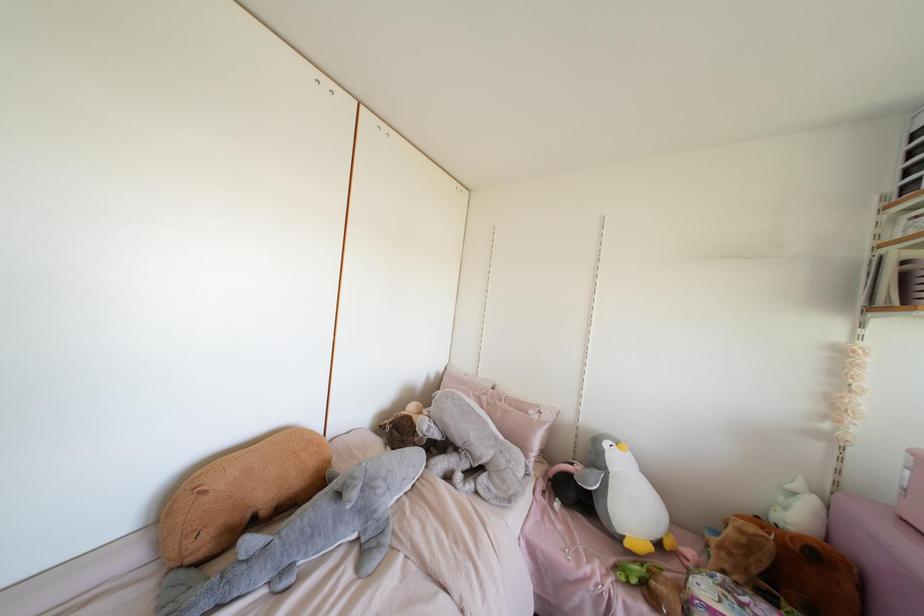
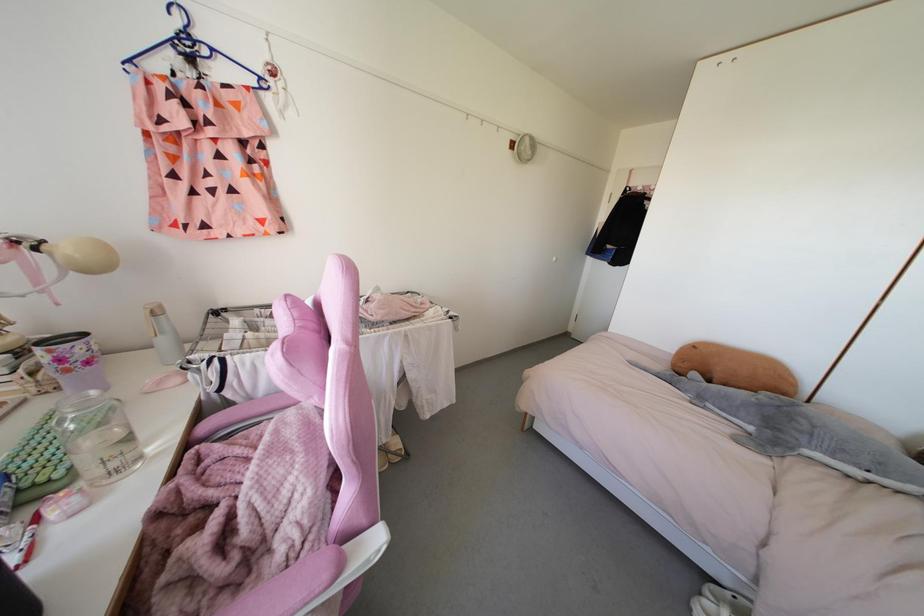
In the second image, find the point that corresponds to [403,479] in the first image.

(843, 450)